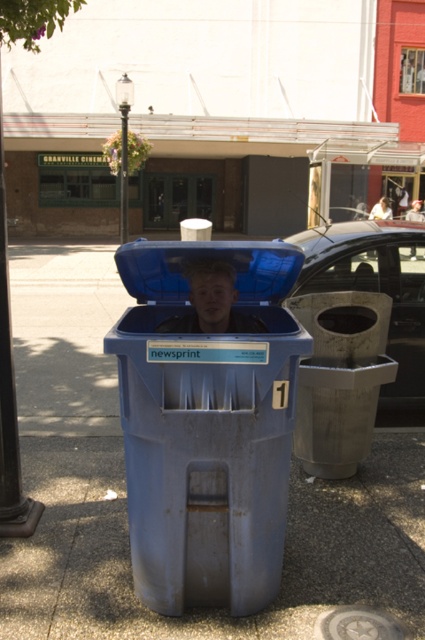
You are a delivery robot trying to navigate to the trash can next to the recycling bin. You need to pass between the gray concrete pavement at lower center and the smooth blue shirt at center. Can you fit through the space between them?

The gray concrete pavement at lower center might be wider than smooth blue shirt at center, so there is a possibility that the space between them is wide enough for the delivery robot to pass through. However, since the exact width isn not specified, the robot should proceed with caution to avoid collision.

You are a delivery person trying to navigate through the street. You see the black polished pole at upper left and the smooth blue shirt at center. Which object is smaller in size?

The black polished pole at upper left is smaller in size compared to the smooth blue shirt at center.

You are a delivery person trying to locate the recycling bin. You see the black polished pole at upper left and the smooth blue shirt at center. Which object is closer to you?

The black polished pole at upper left is closer to you because the smooth blue shirt at center is behind it.